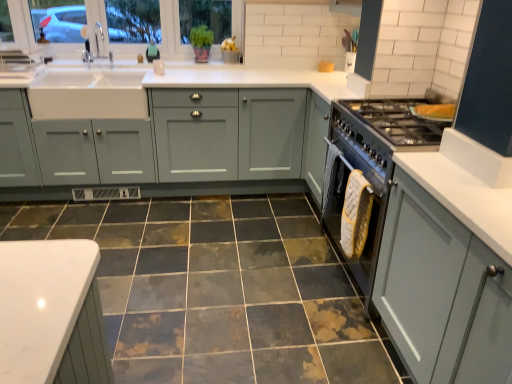
Identify the location of vacant area on top of marbled ceramic tile at center (from a real-world perspective). The width and height of the screenshot is (512, 384). (199, 268).